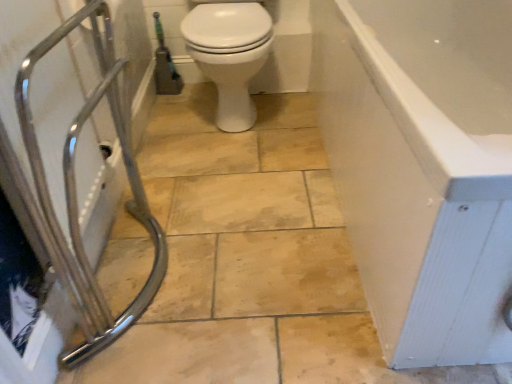
Question: Should I look upward or downward to see chrome metallic shower at left?

Choices:
 (A) up
 (B) down

Answer: (A)

Question: Does white glossy toilet at center have a greater width compared to green rubber garden hose at upper left?

Choices:
 (A) yes
 (B) no

Answer: (A)

Question: From a real-world perspective, does white glossy toilet at center sit lower than green rubber garden hose at upper left?

Choices:
 (A) no
 (B) yes

Answer: (A)

Question: Is white glossy toilet at center positioned behind green rubber garden hose at upper left?

Choices:
 (A) no
 (B) yes

Answer: (A)

Question: Is white glossy toilet at center positioned far away from green rubber garden hose at upper left?

Choices:
 (A) no
 (B) yes

Answer: (A)

Question: From the image's perspective, is white glossy toilet at center on green rubber garden hose at upper left?

Choices:
 (A) no
 (B) yes

Answer: (A)

Question: Does white glossy toilet at center have a greater height compared to green rubber garden hose at upper left?

Choices:
 (A) yes
 (B) no

Answer: (A)

Question: Is white glossy bathtub at right with chrome metallic shower at left?

Choices:
 (A) no
 (B) yes

Answer: (A)

Question: Is chrome metallic shower at left inside white glossy bathtub at right?

Choices:
 (A) no
 (B) yes

Answer: (A)

Question: Can you confirm if white glossy bathtub at right is smaller than chrome metallic shower at left?

Choices:
 (A) yes
 (B) no

Answer: (B)

Question: Is white glossy bathtub at right positioned with its back to chrome metallic shower at left?

Choices:
 (A) no
 (B) yes

Answer: (A)

Question: Is white glossy bathtub at right outside chrome metallic shower at left?

Choices:
 (A) yes
 (B) no

Answer: (A)

Question: Does white glossy bathtub at right lie in front of chrome metallic shower at left?

Choices:
 (A) yes
 (B) no

Answer: (B)

Question: Does green rubber garden hose at upper left lie behind chrome metallic shower at left?

Choices:
 (A) no
 (B) yes

Answer: (B)